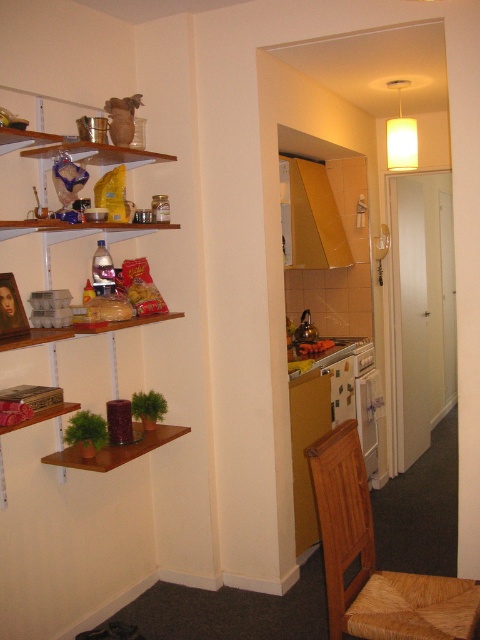
Is woven straw chair at lower right to the left of gold cardboard exhaust hood at upper center from the viewer's perspective?

Incorrect, woven straw chair at lower right is not on the left side of gold cardboard exhaust hood at upper center.

Between point (417, 627) and point (298, 236), which one is positioned behind?

The point (298, 236) is more distant.

Find the location of a particular element. The image size is (480, 640). woven straw chair at lower right is located at coordinates (382, 554).

Image resolution: width=480 pixels, height=640 pixels. I want to click on woven straw chair at lower right, so click(x=382, y=554).

Does gold cardboard exhaust hood at upper center have a greater width compared to smooth plastic container at center?

Indeed, gold cardboard exhaust hood at upper center has a greater width compared to smooth plastic container at center.

Which is below, gold cardboard exhaust hood at upper center or smooth plastic container at center?

smooth plastic container at center is lower down.

Which is in front, point (348, 264) or point (303, 348)?

Point (303, 348) is more forward.

Identify the location of gold cardboard exhaust hood at upper center. (314, 218).

Does woven straw chair at lower right have a greater height compared to smooth plastic container at center?

Correct, woven straw chair at lower right is much taller as smooth plastic container at center.

Image resolution: width=480 pixels, height=640 pixels. What do you see at coordinates (382, 554) in the screenshot? I see `woven straw chair at lower right` at bounding box center [382, 554].

Image resolution: width=480 pixels, height=640 pixels. Find the location of `woven straw chair at lower right`. woven straw chair at lower right is located at coordinates (382, 554).